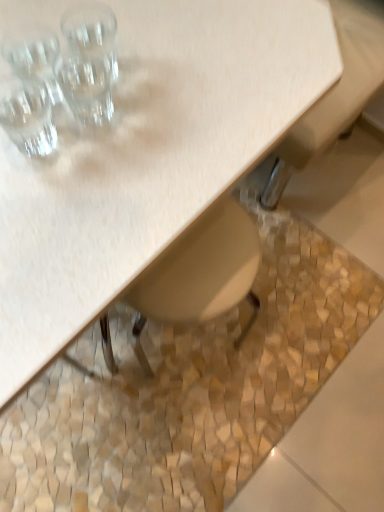
This screenshot has height=512, width=384. I want to click on vacant space to the right of clear glass shot glass at upper left, which appears as the 1th shot glass when ordered from the bottom, so click(151, 140).